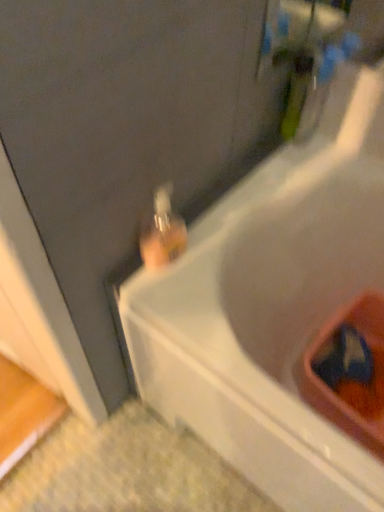
Where is `spots to the right of translucent glass bottle at upper center`? spots to the right of translucent glass bottle at upper center is located at coordinates (212, 246).